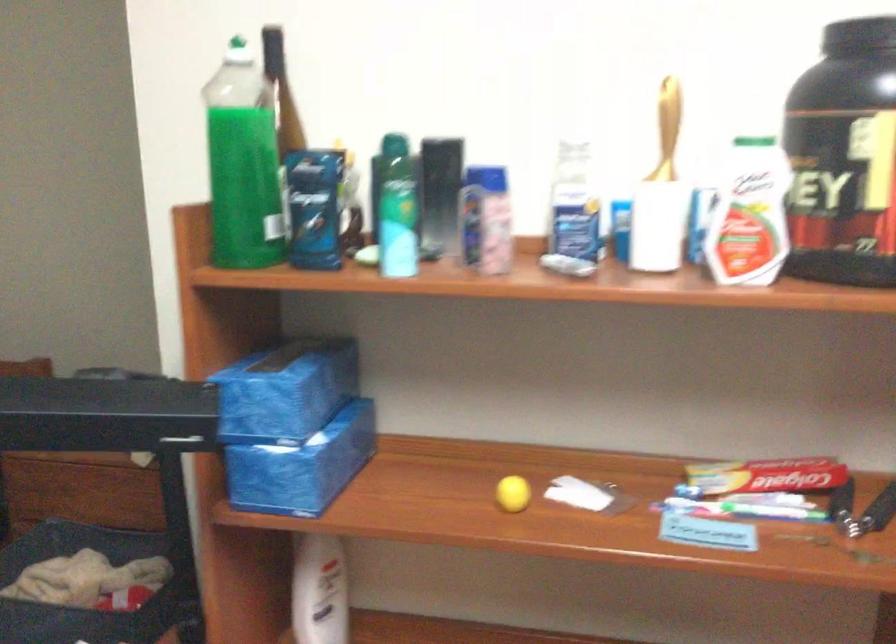
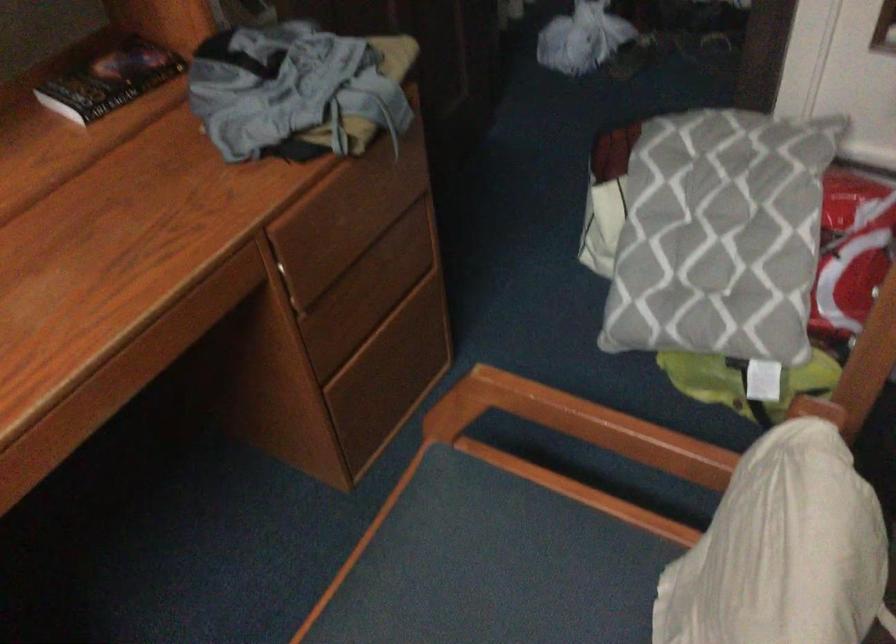
First-person continuous shooting, in which direction is the camera rotating?

The camera rotated toward left-down.